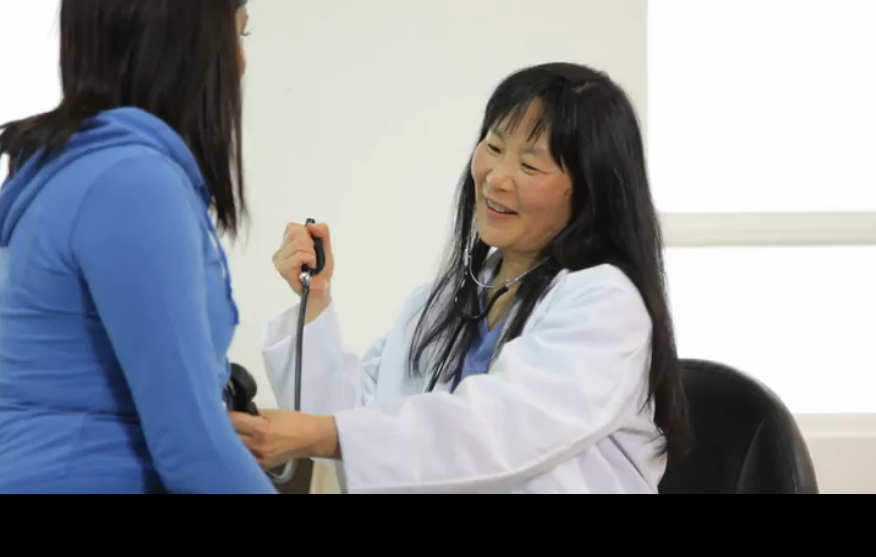
Locate an element on the screen. window is located at coordinates (788, 158).